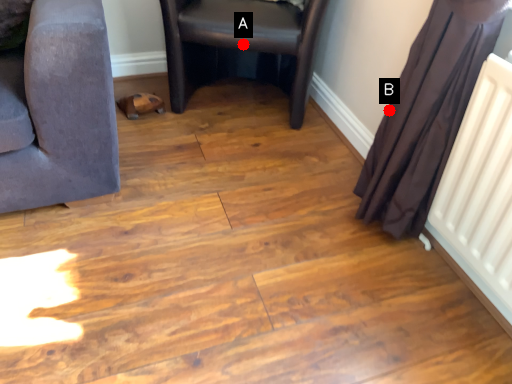
Question: Two points are circled on the image, labeled by A and B beside each circle. Which point is closer to the camera?

Choices:
 (A) A is closer
 (B) B is closer

Answer: (B)